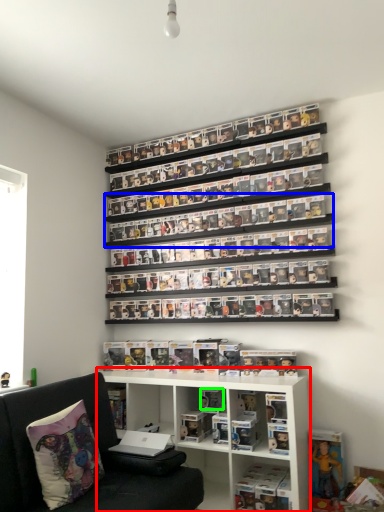
Question: Which is farther away from shelf (highlighted by a red box)? shelf (highlighted by a blue box) or toy (highlighted by a green box)?

Choices:
 (A) shelf
 (B) toy

Answer: (A)